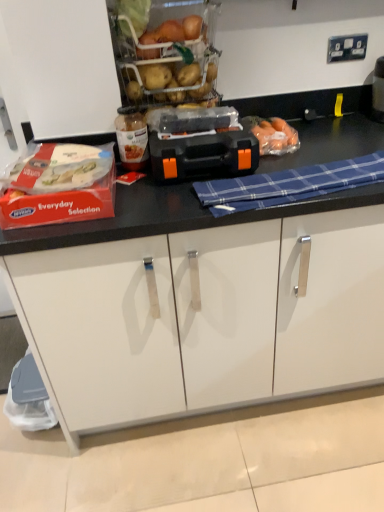
Question: Is black plastic toolbox at center spatially inside blue plaid cloth at center, or outside of it?

Choices:
 (A) outside
 (B) inside

Answer: (A)

Question: Is black plastic toolbox at center taller or shorter than blue plaid cloth at center?

Choices:
 (A) short
 (B) tall

Answer: (B)

Question: Which object is positioned farthest from the translucent plastic carrots at center, acting as the 2th food starting from the left?

Choices:
 (A) white plastic food at left, which appears as the 1th food when viewed from the left
 (B) black plastic toolbox at center
 (C) blue plaid cloth at center
 (D) translucent glass jar at center
 (E) white matte cabinet at lower center

Answer: (E)

Question: Estimate the real-world distances between objects in this image. Which object is farther from the black plastic toolbox at center?

Choices:
 (A) white plastic food at left, which appears as the 1th food when viewed from the left
 (B) translucent plastic carrots at center, acting as the 2th food starting from the left
 (C) white matte cabinet at lower center
 (D) blue plaid cloth at center
 (E) translucent glass jar at center

Answer: (C)